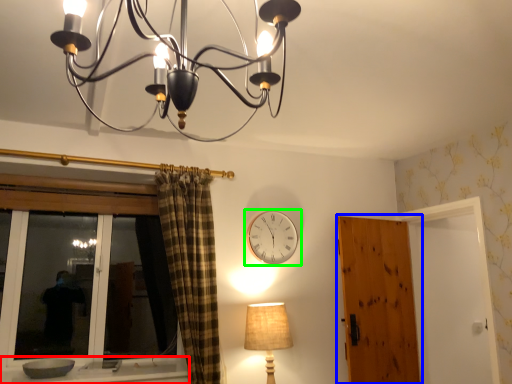
Question: Which object is the closest to the window sill (highlighted by a red box)? Choose among these: door (highlighted by a blue box) or wall clock (highlighted by a green box).

Choices:
 (A) door
 (B) wall clock

Answer: (B)